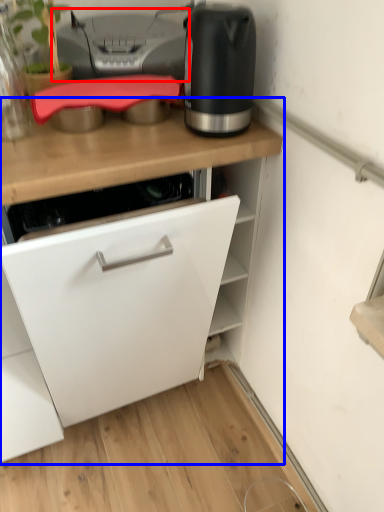
Question: Which of the following is the closest to the observer, printer (highlighted by a red box) or cabinetry (highlighted by a blue box)?

Choices:
 (A) printer
 (B) cabinetry

Answer: (B)